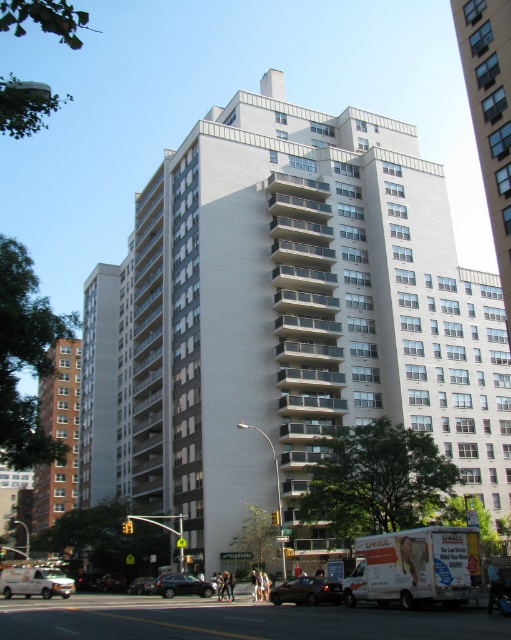
Can you confirm if shiny brown car at lower center is positioned to the right of silver metallic sedan at center?

Yes, shiny brown car at lower center is to the right of silver metallic sedan at center.

In the scene shown: Between shiny brown car at lower center and silver metallic sedan at center, which one is positioned lower?

silver metallic sedan at center is lower down.

This screenshot has height=640, width=511. What are the coordinates of `shiny brown car at lower center` in the screenshot? It's located at (308, 589).

Does point (60, 387) come farther from viewer compared to point (56, 577)?

Yes, point (60, 387) is behind point (56, 577).

Who is lower down, brown brick building at center or white matte van at lower left?

Positioned lower is white matte van at lower left.

Describe the element at coordinates (58, 435) in the screenshot. I see `brown brick building at center` at that location.

Where is `brown brick building at center`? This screenshot has height=640, width=511. brown brick building at center is located at coordinates (58, 435).

Is point (147, 429) less distant than point (146, 584)?

No, (147, 429) is further to viewer.

Who is more distant from viewer, (x=207, y=280) or (x=134, y=580)?

The point (x=134, y=580) is behind.

Where is `white concrete building at center`? This screenshot has width=511, height=640. white concrete building at center is located at coordinates (285, 321).